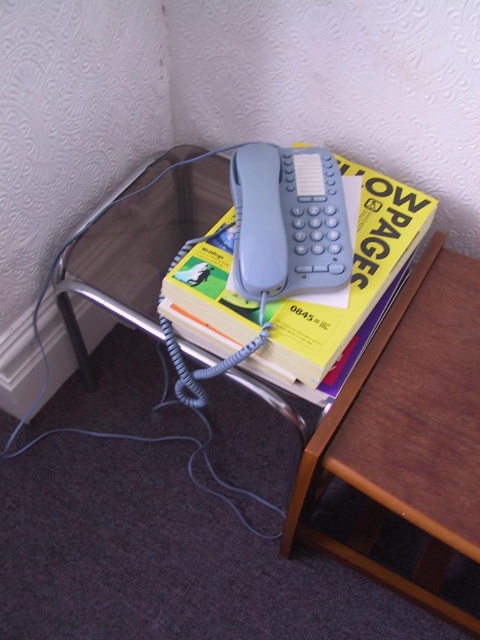
Does yellow paperbacks at center lie behind matte gray phone at center?

Yes, it is.

Who is positioned more to the right, yellow paperbacks at center or matte gray phone at center?

yellow paperbacks at center

You are a GUI agent. You are given a task and a screenshot of the screen. Output one action in this format:
    pyautogui.click(x=<x>, y=<y>)
    Task: Click on the yellow paperbacks at center
    Image resolution: width=480 pixels, height=640 pixels.
    Given the screenshot: What is the action you would take?
    pyautogui.click(x=347, y=289)

Can you confirm if matte plastic phone at upper center is positioned to the right of matte gray phone at center?

Incorrect, matte plastic phone at upper center is not on the right side of matte gray phone at center.

What do you see at coordinates (139, 250) in the screenshot? This screenshot has width=480, height=640. I see `matte plastic phone at upper center` at bounding box center [139, 250].

Identify the location of matte plastic phone at upper center. (139, 250).

Looking at this image, between matte plastic phone at upper center and yellow paperbacks at center, which one appears on the right side from the viewer's perspective?

yellow paperbacks at center is more to the right.

Where is `matte plastic phone at upper center`? This screenshot has height=640, width=480. matte plastic phone at upper center is located at coordinates coord(139,250).

Image resolution: width=480 pixels, height=640 pixels. Identify the location of matte plastic phone at upper center. (139, 250).